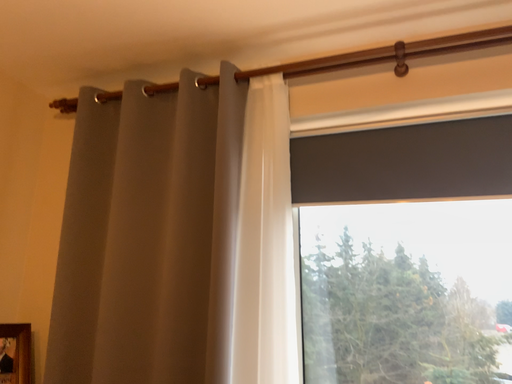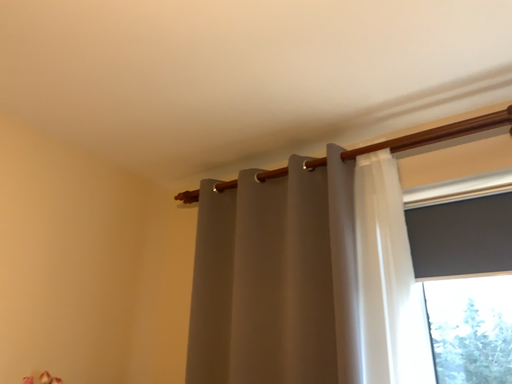
Question: Which way did the camera rotate in the video?

Choices:
 (A) rotated downward
 (B) rotated upward

Answer: (B)